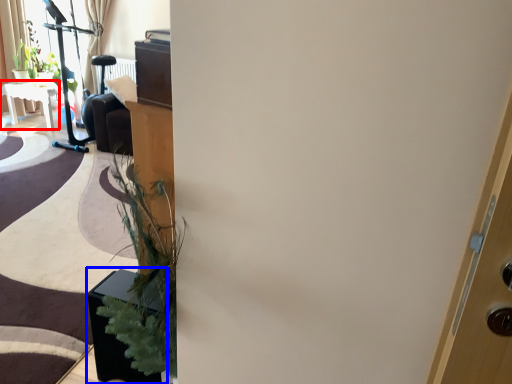
Question: Which of the following is the farthest to the observer, table (highlighted by a red box) or furniture (highlighted by a blue box)?

Choices:
 (A) table
 (B) furniture

Answer: (A)